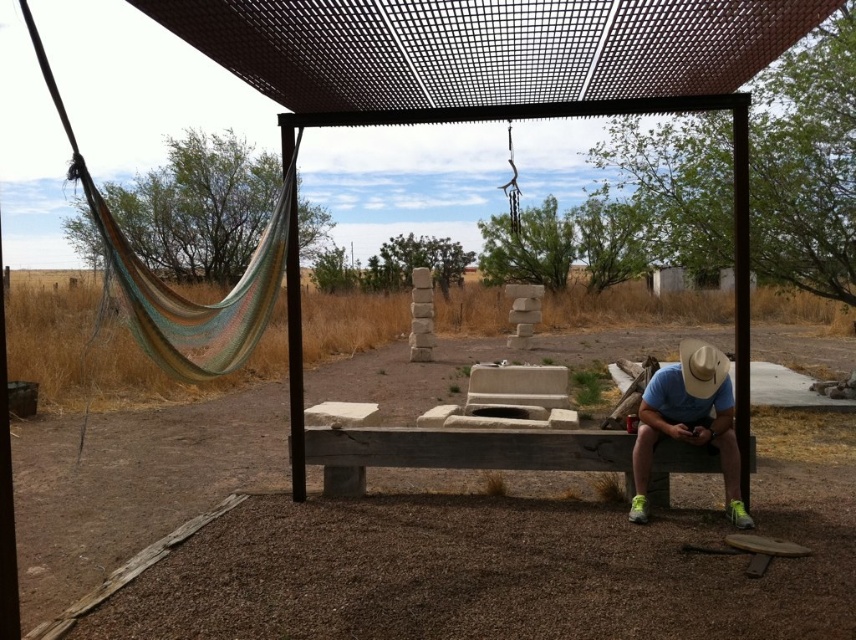
Question: In this image, where is blue cotton shirt at lower right located relative to white felt cowboy hat at right?

Choices:
 (A) below
 (B) above

Answer: (A)

Question: Does blue cotton shirt at lower right have a lesser width compared to white felt cowboy hat at right?

Choices:
 (A) yes
 (B) no

Answer: (B)

Question: Is blue cotton shirt at lower right to the left of white felt cowboy hat at right from the viewer's perspective?

Choices:
 (A) no
 (B) yes

Answer: (B)

Question: Which object appears closest to the camera in this image?

Choices:
 (A) blue cotton shirt at lower right
 (B) white felt cowboy hat at right

Answer: (A)

Question: Which object appears closest to the camera in this image?

Choices:
 (A) blue cotton shirt at lower right
 (B) white felt cowboy hat at right

Answer: (A)

Question: Among these objects, which one is nearest to the camera?

Choices:
 (A) white felt cowboy hat at right
 (B) blue cotton shirt at lower right

Answer: (B)